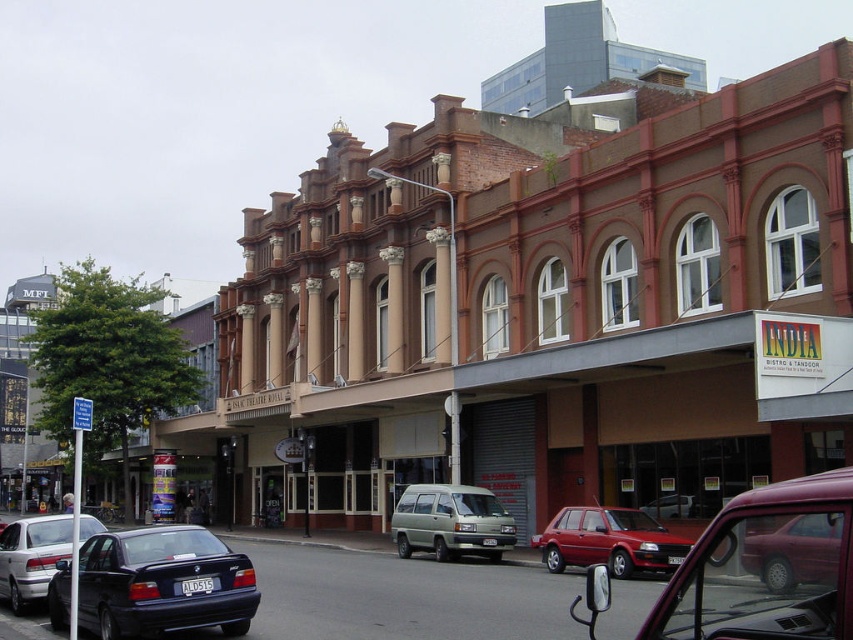
Between metallic red sedan at center and silver metallic sedan at lower left, which one has more height?

With more height is silver metallic sedan at lower left.

Which is more to the right, metallic red sedan at center or silver metallic sedan at lower left?

Positioned to the right is metallic red sedan at center.

The width and height of the screenshot is (853, 640). I want to click on metallic red sedan at center, so click(x=608, y=541).

At what (x,y) coordinates should I click in order to perform the action: click on metallic red sedan at center. Please return your answer as a coordinate pair (x, y). This screenshot has width=853, height=640. Looking at the image, I should click on (608, 541).

Which of these two, shiny black sedan at lower left or metallic red sedan at center, stands shorter?

Standing shorter between the two is shiny black sedan at lower left.

Between shiny black sedan at lower left and metallic red sedan at center, which one appears on the left side from the viewer's perspective?

From the viewer's perspective, shiny black sedan at lower left appears more on the left side.

Is point (250, 608) closer to viewer compared to point (650, 570)?

Yes.

The height and width of the screenshot is (640, 853). I want to click on shiny black sedan at lower left, so click(x=163, y=582).

In the scene shown: Who is more distant from viewer, (708, 577) or (619, 529)?

Positioned behind is point (619, 529).

Find the location of a particular element. This screenshot has height=640, width=853. maroon metallic car at center is located at coordinates (766, 566).